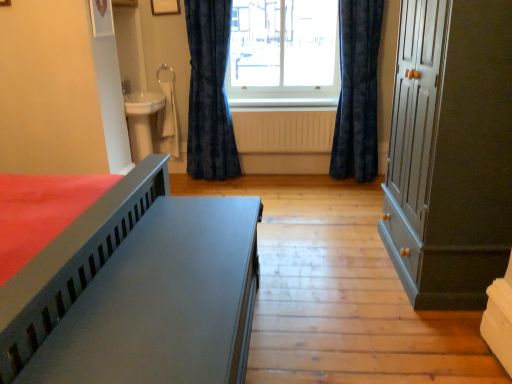
This screenshot has width=512, height=384. I want to click on free space above matte gray bed at lower left (from a real-world perspective), so click(x=185, y=266).